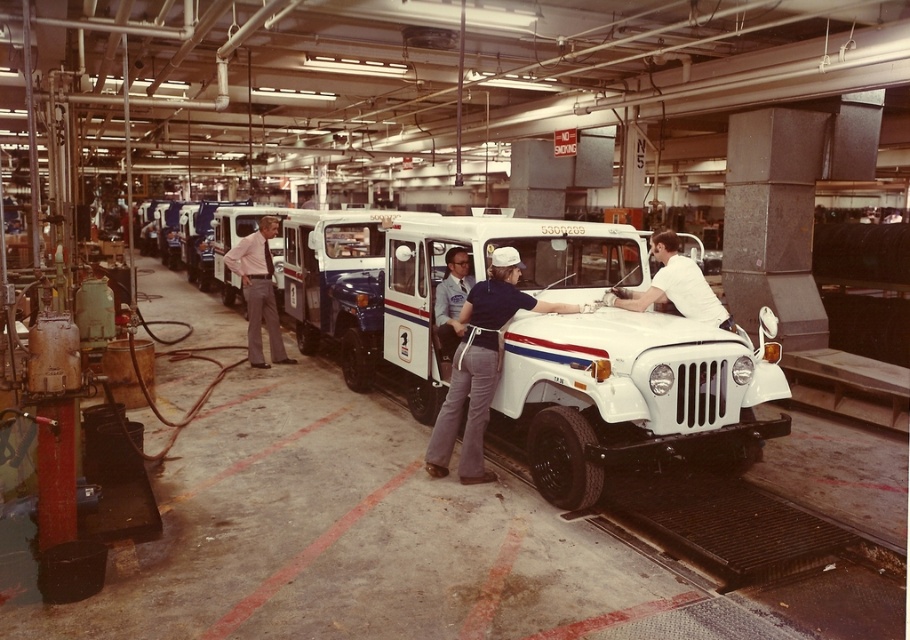
You are a worker in the factory and need to reach the light pink shirt at center from the denim pants at center. Can you walk directly to it without moving any objects?

The denim pants at center is 4.33 meters away from the light pink shirt at center, so yes, you can walk directly to it without moving any objects since the distance is sufficient for movement.

You are standing at the entrance of the factory and see two points marked on the floor, point 1 at coordinates point [477,442] and point 2 at coordinates point [258,282]. Which point is closer to you?

Point [477,442] is closer to the viewer than point [258,282].

Based on the photo, you are an inspector in the factory and you need to check the denim pants at center. Where exactly should you look in the factory floor?

You should look at point [480,364] to find the denim pants at center.